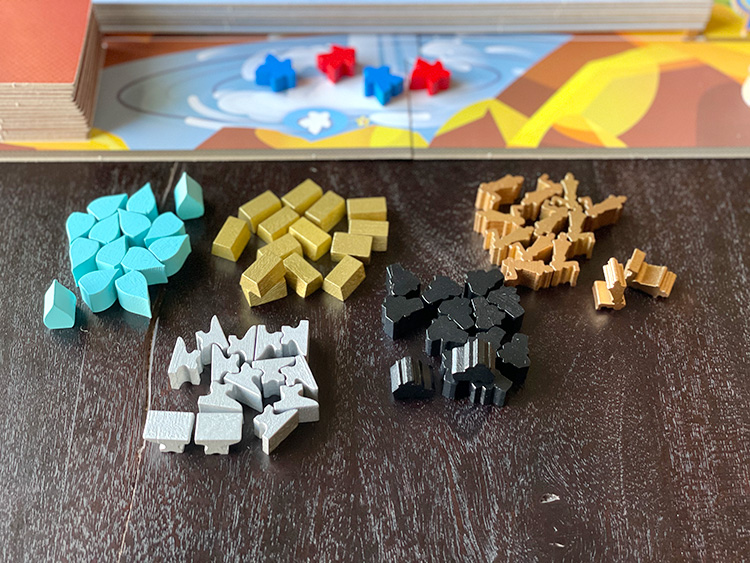
The width and height of the screenshot is (750, 563). I want to click on edge of table, so click(361, 151).